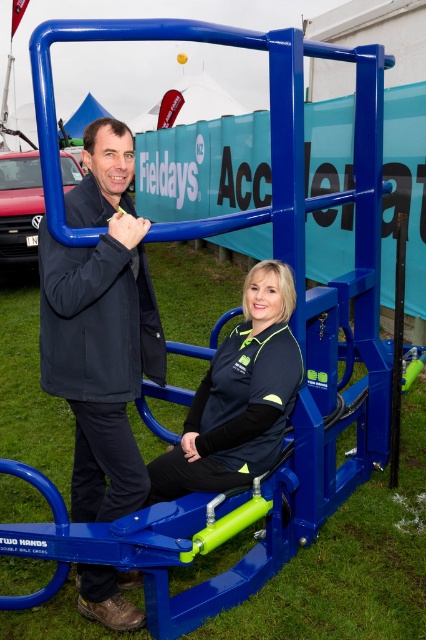
Question: Which point is farther to the camera?

Choices:
 (A) matte black jacket at center
 (B) black fabric jacket at center
 (C) matte blue exercise machine at center

Answer: (B)

Question: Is matte blue exercise machine at center above black fabric jacket at center?

Choices:
 (A) yes
 (B) no

Answer: (A)

Question: Is matte blue exercise machine at center to the right of matte black jacket at center from the viewer's perspective?

Choices:
 (A) no
 (B) yes

Answer: (B)

Question: Which is farther from the black fabric jacket at center?

Choices:
 (A) matte blue exercise machine at center
 (B) matte black jacket at center

Answer: (B)

Question: Does matte blue exercise machine at center have a larger size compared to matte black jacket at center?

Choices:
 (A) no
 (B) yes

Answer: (B)

Question: Which of the following is the farthest from the observer?

Choices:
 (A) matte blue exercise machine at center
 (B) black fabric jacket at center

Answer: (B)